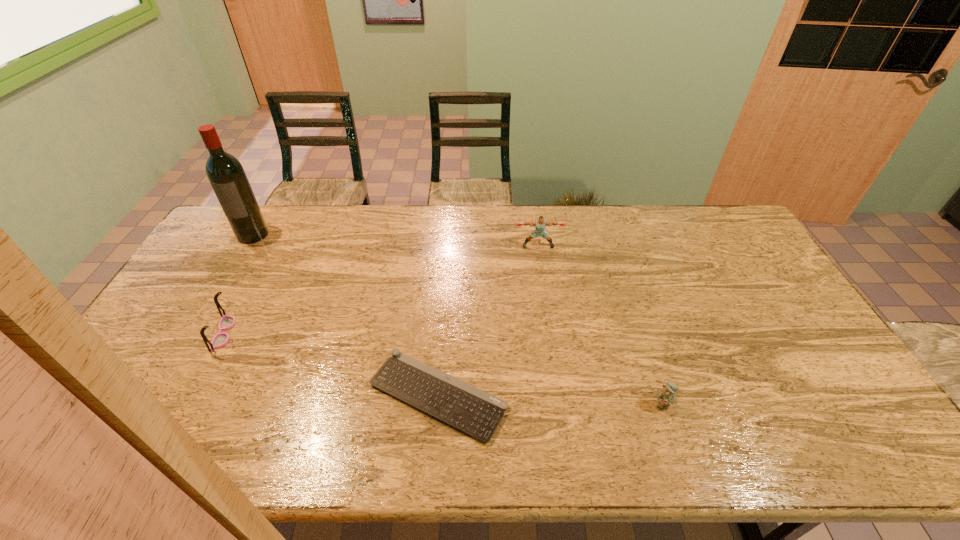
Find the location of a particular element. free spot at the near edge of the desktop is located at coordinates (346, 443).

Locate an element on the screen. The image size is (960, 540). vacant area at the right edge of the desktop is located at coordinates (774, 318).

In the image, there is a desktop. Where is `vacant space at the far right corner`? vacant space at the far right corner is located at coordinates (724, 217).

The width and height of the screenshot is (960, 540). Identify the location of vacant area at the near right corner. (869, 427).

This screenshot has height=540, width=960. Identify the location of vacant area that lies between the puncher and the fourth tallest object. (600, 325).

Identify the location of free spot between the third nearest object and the fourth object from left to right. This screenshot has width=960, height=540. (380, 289).

Identify the location of unoccupied position between the third farthest object and the shortest object. The height and width of the screenshot is (540, 960). (330, 364).

This screenshot has height=540, width=960. I want to click on free spot between the tallest object and the shortest object, so click(x=346, y=315).

Locate an element on the screen. The image size is (960, 540). vacant area that lies between the third nearest object and the computer keyboard is located at coordinates (330, 364).

Locate an element on the screen. vacant region between the tallest object and the puncher is located at coordinates (396, 240).